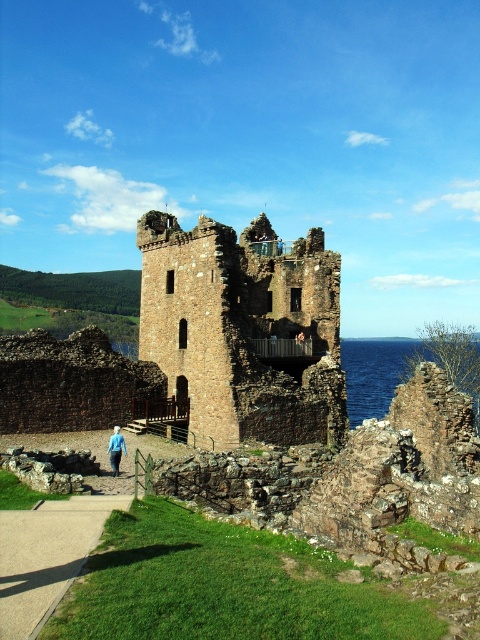
You are standing at the entrance of the medieval stone tower and notice the blue liquid water at right. If you want to reach the water, which direction should you move relative to the tower?

The blue liquid water at right is located at point (x=373, y=372), so you should move towards the right side of the tower to reach it.